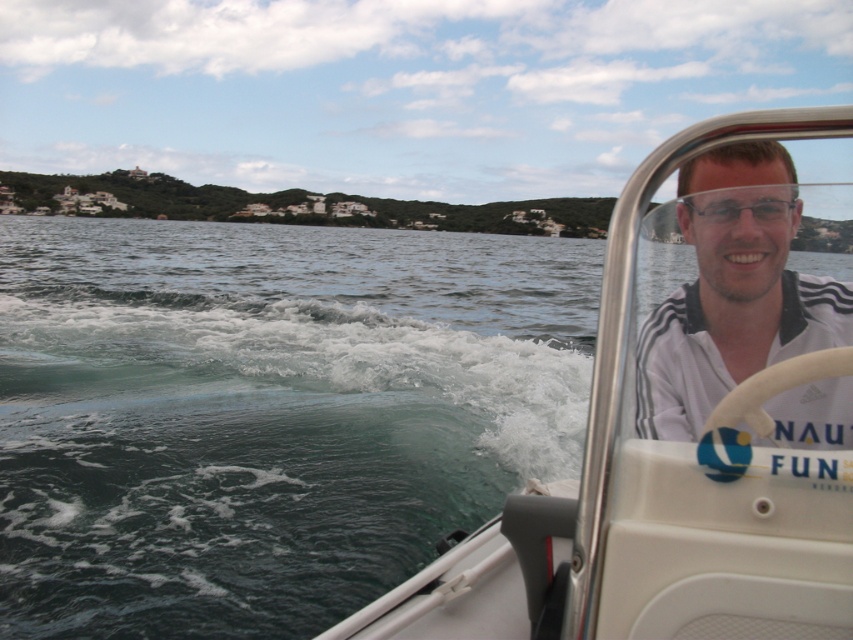
Based on the photo, is white plastic boat at right shorter than clear plastic goggles at upper center?

Incorrect, white plastic boat at right's height does not fall short of clear plastic goggles at upper center's.

Is point (770, 563) closer to viewer compared to point (715, 218)?

Yes, point (770, 563) is closer to viewer.

Between point (836, 529) and point (708, 212), which one is positioned behind?

The point (708, 212) is behind.

At what (x,y) coordinates should I click in order to perform the action: click on white plastic boat at right. Please return your answer as a coordinate pair (x, y). Looking at the image, I should click on (691, 432).

Between white frothy water at lower left and white adidas shirt at center, which one is positioned higher?

white frothy water at lower left is above.

Consider the image. Is white frothy water at lower left behind white adidas shirt at center?

Yes, white frothy water at lower left is further from the viewer.

Locate an element on the screen. white frothy water at lower left is located at coordinates (305, 340).

The image size is (853, 640). In order to click on white frothy water at lower left in this screenshot , I will do `click(305, 340)`.

Can you confirm if white frothy water at lower left is positioned above clear plastic goggles at upper center?

Yes, white frothy water at lower left is above clear plastic goggles at upper center.

Does white frothy water at lower left appear on the left side of clear plastic goggles at upper center?

Yes, white frothy water at lower left is to the left of clear plastic goggles at upper center.

From the picture: Who is more forward, (138, 387) or (763, 211)?

Positioned in front is point (763, 211).

This screenshot has height=640, width=853. What are the coordinates of `white frothy water at lower left` in the screenshot? It's located at (305, 340).